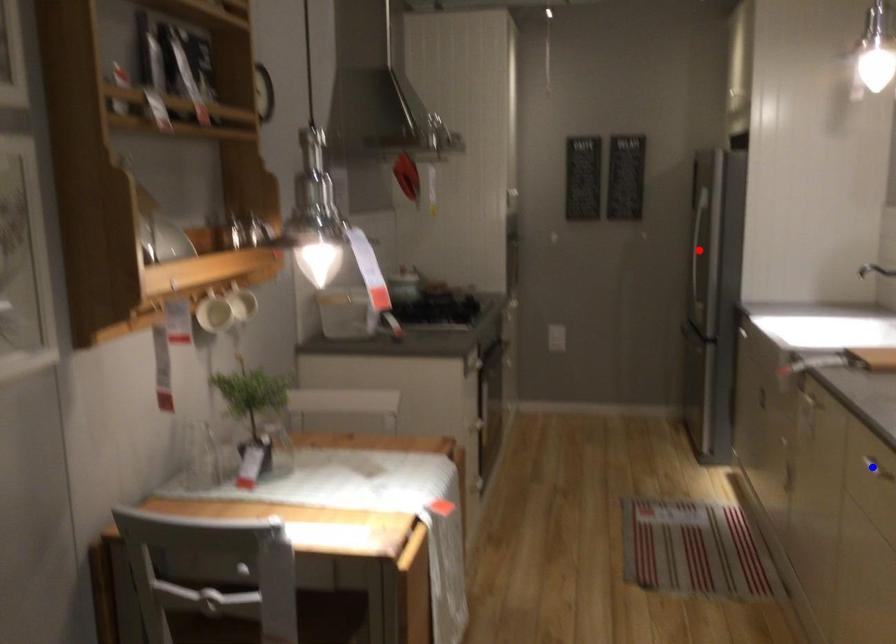
Question: Two points are marked on the image. Which point is closer to the camera?

Choices:
 (A) Blue point is closer.
 (B) Red point is closer.

Answer: (A)